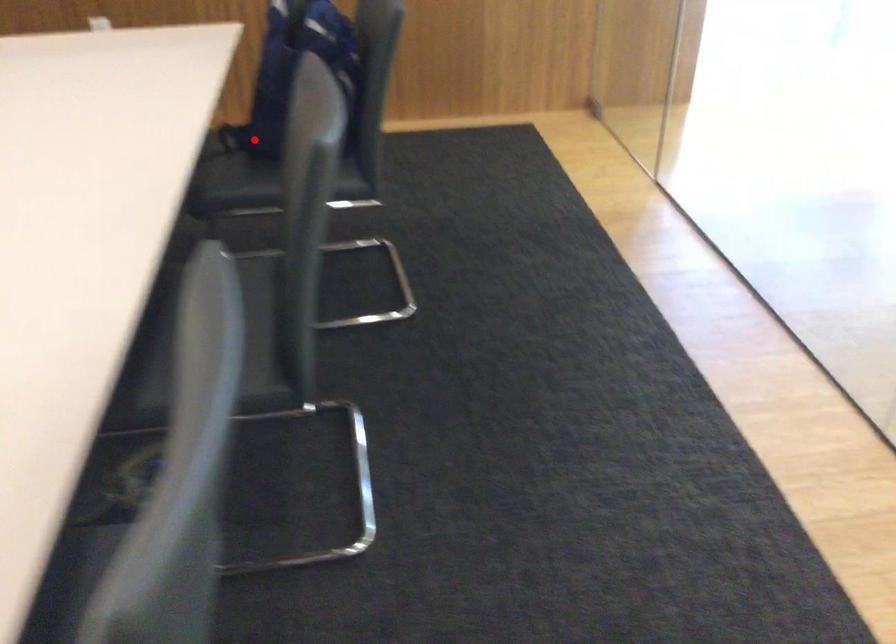
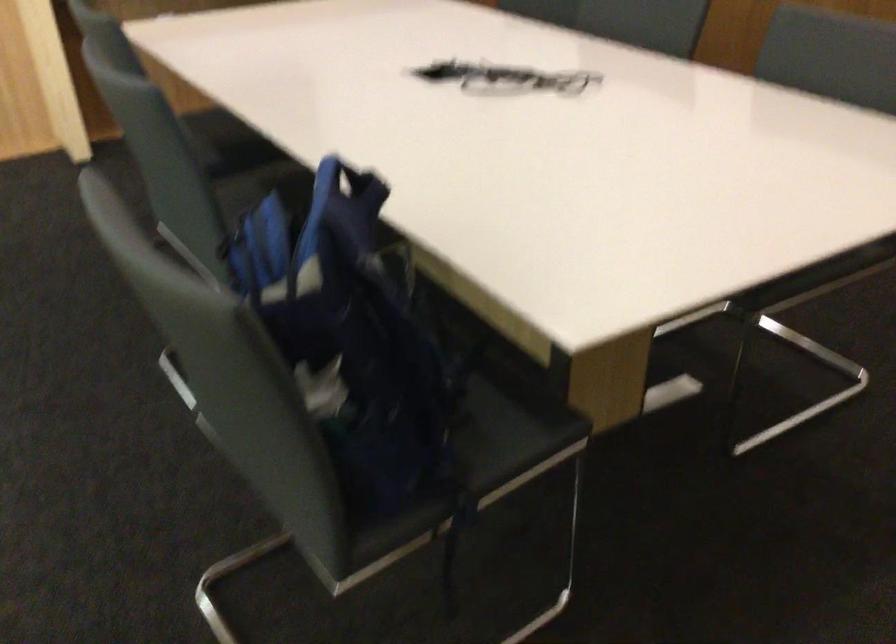
In the second image, find the point that corresponds to the highlighted location in the first image.

(484, 451)